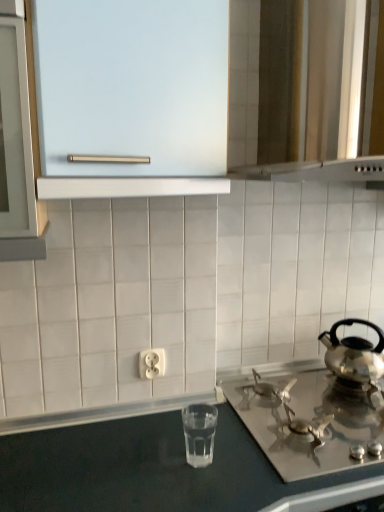
The height and width of the screenshot is (512, 384). What do you see at coordinates (132, 86) in the screenshot?
I see `frosted glass cabinet at upper center` at bounding box center [132, 86].

Measure the distance between frosted glass cabinet at upper center and camera.

frosted glass cabinet at upper center and camera are 30.49 inches apart.

You are a GUI agent. You are given a task and a screenshot of the screen. Output one action in this format:
    pyautogui.click(x=<x>, y=<y>)
    Task: Click on the clear glass water at lower center
    This screenshot has width=384, height=512.
    Given the screenshot: What is the action you would take?
    pyautogui.click(x=199, y=433)

Image resolution: width=384 pixels, height=512 pixels. In order to click on metallic silver vent at upper right in this screenshot , I will do `click(310, 89)`.

Describe the element at coordinates (306, 416) in the screenshot. I see `satin silver gas stove at lower right` at that location.

Identify the location of frosted glass cabinet at upper center. (132, 86).

Considering the relative positions of white plastic outlet at center and clear glass water at lower center in the image provided, is white plastic outlet at center behind clear glass water at lower center?

Yes, white plastic outlet at center is further from the camera.

From a real-world perspective, which is physically above, white plastic outlet at center or clear glass water at lower center?

From a 3D spatial view, white plastic outlet at center is above.

Would you consider white plastic outlet at center to be distant from clear glass water at lower center?

No, white plastic outlet at center is not far from clear glass water at lower center.

Where is `appliance in front of the white plastic outlet at center`? Image resolution: width=384 pixels, height=512 pixels. appliance in front of the white plastic outlet at center is located at coordinates click(x=199, y=433).

From a real-world perspective, is shiny silver kettle at right physically above metallic silver vent at upper right?

No, from a real-world perspective, shiny silver kettle at right is not on top of metallic silver vent at upper right.

Would you say shiny silver kettle at right is outside metallic silver vent at upper right?

Yes, shiny silver kettle at right is not within metallic silver vent at upper right.

Is shiny silver kettle at right beside metallic silver vent at upper right?

No, shiny silver kettle at right is not making contact with metallic silver vent at upper right.

From a real-world perspective, is clear glass water at lower center physically located above or below shiny silver kettle at right?

In terms of real-world spatial position, clear glass water at lower center is below shiny silver kettle at right.

Considering the positions of objects clear glass water at lower center and shiny silver kettle at right in the image provided, who is more to the left, clear glass water at lower center or shiny silver kettle at right?

clear glass water at lower center is more to the left.

Considering the relative sizes of clear glass water at lower center and shiny silver kettle at right in the image provided, is clear glass water at lower center bigger than shiny silver kettle at right?

Incorrect, clear glass water at lower center is not larger than shiny silver kettle at right.

The height and width of the screenshot is (512, 384). I want to click on appliance below the shiny silver kettle at right (from a real-world perspective), so click(x=199, y=433).

From the image's perspective, is white plastic outlet at center beneath satin silver gas stove at lower right?

No, from the image's perspective, white plastic outlet at center is not beneath satin silver gas stove at lower right.

Between white plastic outlet at center and satin silver gas stove at lower right, which one has more height?

white plastic outlet at center.

From a real-world perspective, is white plastic outlet at center under satin silver gas stove at lower right?

No.

Is white plastic outlet at center oriented away from satin silver gas stove at lower right?

No, white plastic outlet at center is not facing the opposite direction of satin silver gas stove at lower right.

Considering the sizes of satin silver gas stove at lower right and frosted glass cabinet at upper center in the image, is satin silver gas stove at lower right bigger or smaller than frosted glass cabinet at upper center?

Clearly, satin silver gas stove at lower right is smaller in size than frosted glass cabinet at upper center.

Which point is more forward, (336, 425) or (124, 41)?

The point (124, 41) is in front.

In the scene shown: Which of these two, satin silver gas stove at lower right or frosted glass cabinet at upper center, stands taller?

frosted glass cabinet at upper center.

Is satin silver gas stove at lower right outside of frosted glass cabinet at upper center?

Yes, satin silver gas stove at lower right is outside of frosted glass cabinet at upper center.

Considering the relative sizes of clear glass water at lower center and satin silver gas stove at lower right in the image provided, is clear glass water at lower center taller than satin silver gas stove at lower right?

Yes, clear glass water at lower center is taller than satin silver gas stove at lower right.

This screenshot has height=512, width=384. I want to click on gas stove that appears on the right of clear glass water at lower center, so click(x=306, y=416).

In the scene shown: Is clear glass water at lower center to the right of satin silver gas stove at lower right from the viewer's perspective?

Incorrect, clear glass water at lower center is not on the right side of satin silver gas stove at lower right.

From the image's perspective, is clear glass water at lower center located beneath satin silver gas stove at lower right?

Actually, clear glass water at lower center appears above satin silver gas stove at lower right in the image.

Relative to white plastic outlet at center, is clear glass water at lower center in front or behind?

clear glass water at lower center is in front of white plastic outlet at center.

Is clear glass water at lower center directly adjacent to white plastic outlet at center?

No, clear glass water at lower center is not making contact with white plastic outlet at center.

Is clear glass water at lower center facing away from white plastic outlet at center?

Yes, clear glass water at lower center is facing away from white plastic outlet at center.

Identify the location of electric outlet to the left of clear glass water at lower center. (152, 362).

Where is `kettle directly beneath the metallic silver vent at upper right (from a real-world perspective)`? The width and height of the screenshot is (384, 512). kettle directly beneath the metallic silver vent at upper right (from a real-world perspective) is located at coordinates (354, 353).

Consider the image. When comparing their distances from satin silver gas stove at lower right, does clear glass water at lower center or metallic silver vent at upper right seem further?

Based on the image, metallic silver vent at upper right appears to be further to satin silver gas stove at lower right.

Which object lies nearer to the anchor point white plastic outlet at center, frosted glass cabinet at upper center or metallic silver vent at upper right?

frosted glass cabinet at upper center is positioned closer to the anchor white plastic outlet at center.

Estimate the real-world distances between objects in this image. Which object is further from white plastic outlet at center, satin silver gas stove at lower right or metallic silver vent at upper right?

metallic silver vent at upper right.

In the scene shown: Based on their spatial positions, is frosted glass cabinet at upper center or white plastic outlet at center closer to shiny silver kettle at right?

white plastic outlet at center is closer to shiny silver kettle at right.

From the image, which object appears to be farther from white plastic outlet at center, shiny silver kettle at right or satin silver gas stove at lower right?

shiny silver kettle at right is further to white plastic outlet at center.

Which object lies further to the anchor point clear glass water at lower center, metallic silver vent at upper right or white plastic outlet at center?

metallic silver vent at upper right is positioned further to the anchor clear glass water at lower center.

Considering their positions, is satin silver gas stove at lower right positioned closer to frosted glass cabinet at upper center than clear glass water at lower center?

clear glass water at lower center is closer to frosted glass cabinet at upper center.

When comparing their distances from satin silver gas stove at lower right, does frosted glass cabinet at upper center or shiny silver kettle at right seem further?

frosted glass cabinet at upper center is positioned further to the anchor satin silver gas stove at lower right.

Locate an element on the screen. The image size is (384, 512). glass door between metallic silver vent at upper right and white plastic outlet at center vertically is located at coordinates (132, 86).

The height and width of the screenshot is (512, 384). Identify the location of kettle between metallic silver vent at upper right and clear glass water at lower center vertically. (354, 353).

Identify the location of glass door between metallic silver vent at upper right and satin silver gas stove at lower right in the vertical direction. The height and width of the screenshot is (512, 384). click(x=132, y=86).

Where is `gas stove located between clear glass water at lower center and shiny silver kettle at right in the left-right direction`? gas stove located between clear glass water at lower center and shiny silver kettle at right in the left-right direction is located at coordinates (306, 416).